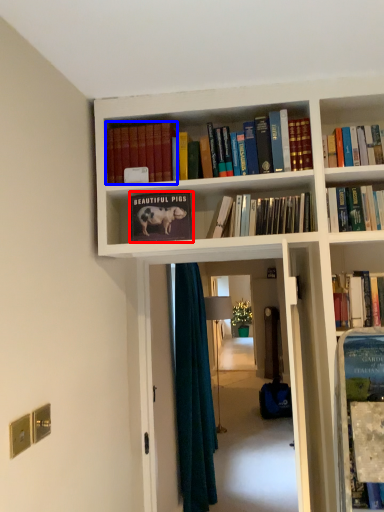
Question: Which of the following is the closest to the observer, book (highlighted by a red box) or book (highlighted by a blue box)?

Choices:
 (A) book
 (B) book

Answer: (A)